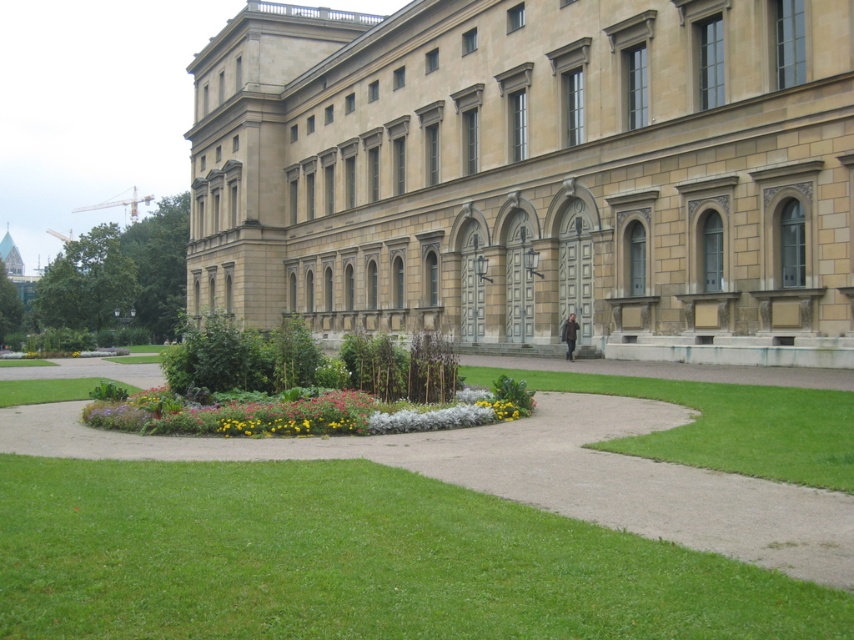
Can you confirm if beige stone building at center is positioned to the right of green grass at center?

No, beige stone building at center is not to the right of green grass at center.

Can you confirm if beige stone building at center is positioned below green grass at center?

No.

At what (x,y) coordinates should I click in order to perform the action: click on beige stone building at center. Please return your answer as a coordinate pair (x, y). Looking at the image, I should click on (534, 173).